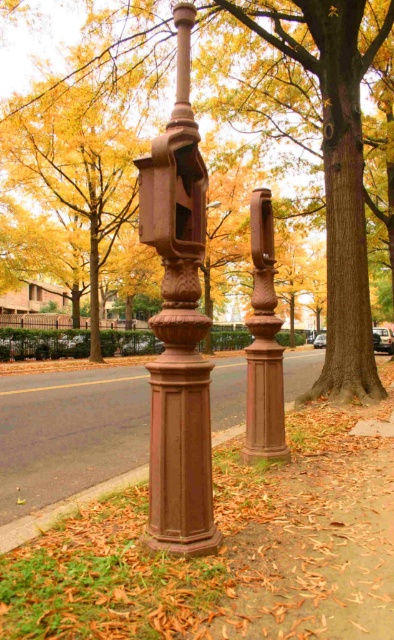
Does rusty metal pillar at center have a larger size compared to brown polished pillar at center?

Yes.

Does rusty metal pillar at center appear over brown polished pillar at center?

Yes.

Locate an element on the screen. This screenshot has width=394, height=640. rusty metal pillar at center is located at coordinates (178, 324).

At what (x,y) coordinates should I click in order to perform the action: click on rusty metal pillar at center. Please return your answer as a coordinate pair (x, y). The height and width of the screenshot is (640, 394). Looking at the image, I should click on (178, 324).

Can you confirm if brown wood tree at center is thinner than brown polished stone post at center?

Indeed, brown wood tree at center has a lesser width compared to brown polished stone post at center.

Who is positioned more to the left, brown wood tree at center or brown polished stone post at center?

Positioned to the left is brown polished stone post at center.

Who is more distant from viewer, (269, 33) or (289, 387)?

The point (289, 387) is behind.

Find the location of a particular element. The image size is (394, 640). brown wood tree at center is located at coordinates (330, 161).

Can you confirm if brown polished stone post at center is positioned to the left of brown cast iron at lower center?

Correct, you'll find brown polished stone post at center to the left of brown cast iron at lower center.

Locate an element on the screen. This screenshot has width=394, height=640. brown polished stone post at center is located at coordinates (70, 445).

In order to click on brown polished stone post at center in this screenshot , I will do `click(70, 445)`.